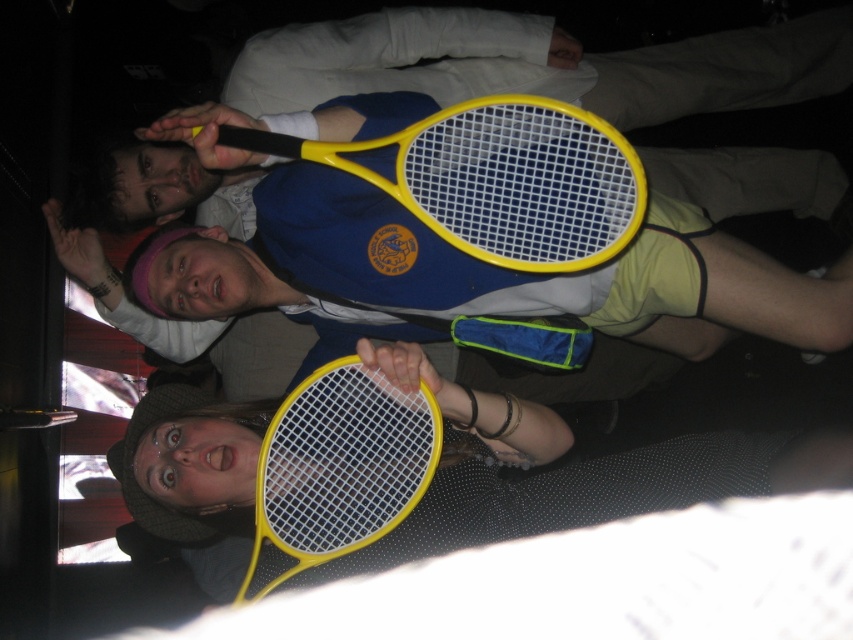
Question: Which point is farther from the camera taking this photo?

Choices:
 (A) (270, 548)
 (B) (299, 156)

Answer: (A)

Question: Is yellow plastic racket at upper center in front of yellow plastic racket at lower center?

Choices:
 (A) no
 (B) yes

Answer: (B)

Question: Is yellow plastic racket at upper center positioned behind yellow plastic racket at lower center?

Choices:
 (A) yes
 (B) no

Answer: (B)

Question: Which of the following is the farthest from the observer?

Choices:
 (A) (396, 484)
 (B) (560, 113)

Answer: (A)

Question: Is yellow plastic racket at upper center smaller than yellow plastic racket at lower center?

Choices:
 (A) yes
 (B) no

Answer: (B)